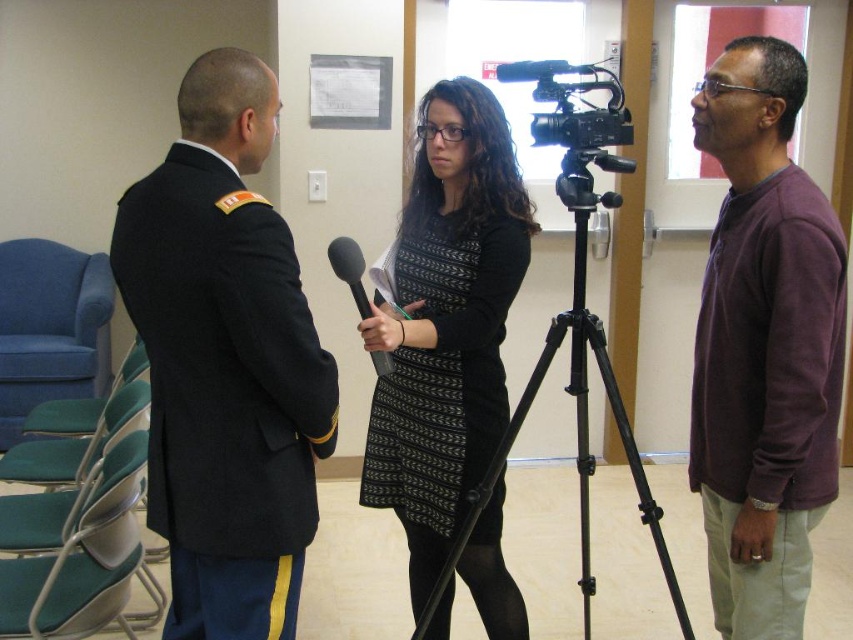
Question: Does black textured dress at center appear over black plastic video camera at center?

Choices:
 (A) yes
 (B) no

Answer: (B)

Question: Considering the relative positions of purple matte shirt at right and black textured dress at center in the image provided, where is purple matte shirt at right located with respect to black textured dress at center?

Choices:
 (A) below
 (B) above

Answer: (B)

Question: Which point is farther to the camera?

Choices:
 (A) black matte microphone at center
 (B) black textured dress at center
 (C) purple matte shirt at right

Answer: (B)

Question: Does purple matte shirt at right appear over black textured dress at center?

Choices:
 (A) no
 (B) yes

Answer: (B)

Question: Among these points, which one is farthest from the camera?

Choices:
 (A) (354, 276)
 (B) (593, 125)

Answer: (B)

Question: Among these points, which one is nearest to the camera?

Choices:
 (A) (561, 65)
 (B) (590, 145)
 (C) (822, 252)
 (D) (380, 364)

Answer: (C)